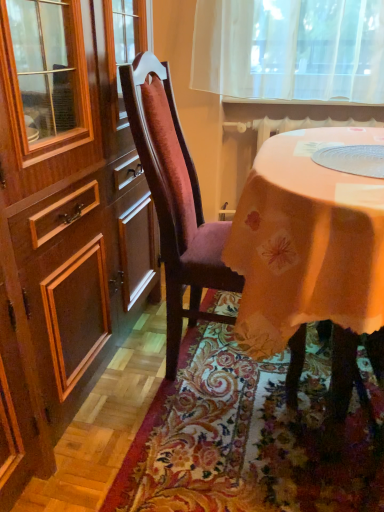
Describe the element at coordinates (175, 200) in the screenshot. The width and height of the screenshot is (384, 512). I see `velvet burgundy chair at center` at that location.

Image resolution: width=384 pixels, height=512 pixels. I want to click on velvet burgundy chair at center, so click(175, 200).

The image size is (384, 512). What do you see at coordinates (244, 439) in the screenshot?
I see `floral carpet at lower center` at bounding box center [244, 439].

Find the location of a particular element. The height and width of the screenshot is (512, 384). floral carpet at lower center is located at coordinates (244, 439).

Find the location of a particular element. The image size is (384, 512). velvet burgundy chair at center is located at coordinates (175, 200).

Can you confirm if floral carpet at lower center is positioned to the right of velvet burgundy chair at center?

Correct, you'll find floral carpet at lower center to the right of velvet burgundy chair at center.

Does floral carpet at lower center lie behind velvet burgundy chair at center?

No, floral carpet at lower center is closer to the viewer.

Is point (228, 420) closer to camera compared to point (179, 254)?

No, it is not.

From the image's perspective, between floral carpet at lower center and velvet burgundy chair at center, which one is located above?

velvet burgundy chair at center, from the image's perspective.

From a real-world perspective, is floral carpet at lower center physically below velvet burgundy chair at center?

Correct, in the physical world, floral carpet at lower center is lower than velvet burgundy chair at center.

Considering the sizes of objects floral carpet at lower center and velvet burgundy chair at center in the image provided, who is thinner, floral carpet at lower center or velvet burgundy chair at center?

Thinner between the two is velvet burgundy chair at center.

Does floral carpet at lower center have a lesser height compared to velvet burgundy chair at center?

Indeed, floral carpet at lower center has a lesser height compared to velvet burgundy chair at center.

Which of these two, floral carpet at lower center or velvet burgundy chair at center, is bigger?

Bigger between the two is velvet burgundy chair at center.

Is floral carpet at lower center outside of velvet burgundy chair at center?

Yes.

Is floral carpet at lower center far from velvet burgundy chair at center?

They are positioned close to each other.

Is floral carpet at lower center oriented towards velvet burgundy chair at center?

Yes, floral carpet at lower center is oriented towards velvet burgundy chair at center.

What's the angular difference between floral carpet at lower center and velvet burgundy chair at center's facing directions?

They differ by 91.2 degrees in their facing directions.

This screenshot has height=512, width=384. I want to click on mat located below the velvet burgundy chair at center (from the image's perspective), so [244, 439].

Does velvet burgundy chair at center appear on the right side of floral carpet at lower center?

In fact, velvet burgundy chair at center is to the left of floral carpet at lower center.

Which object is further away from the camera taking this photo, velvet burgundy chair at center or floral carpet at lower center?

Positioned behind is velvet burgundy chair at center.

Which is closer, (152, 90) or (227, 338)?

Point (152, 90) is positioned closer to the camera compared to point (227, 338).

From the image's perspective, which is below, velvet burgundy chair at center or floral carpet at lower center?

From the image's view, floral carpet at lower center is below.

From a real-world perspective, which object rests below the other?

In real-world perspective, floral carpet at lower center is lower.

Considering the sizes of velvet burgundy chair at center and floral carpet at lower center in the image, is velvet burgundy chair at center wider or thinner than floral carpet at lower center?

In the image, velvet burgundy chair at center appears to be more narrow than floral carpet at lower center.

In the scene shown: Who is taller, velvet burgundy chair at center or floral carpet at lower center?

velvet burgundy chair at center.

Considering the relative sizes of velvet burgundy chair at center and floral carpet at lower center in the image provided, is velvet burgundy chair at center bigger than floral carpet at lower center?

Correct, velvet burgundy chair at center is larger in size than floral carpet at lower center.

Is velvet burgundy chair at center not within floral carpet at lower center?

Absolutely, velvet burgundy chair at center is external to floral carpet at lower center.

Is velvet burgundy chair at center next to floral carpet at lower center?

No, velvet burgundy chair at center is not touching floral carpet at lower center.

Could you tell me if velvet burgundy chair at center is facing floral carpet at lower center?

No.

Can you tell me how much velvet burgundy chair at center and floral carpet at lower center differ in facing direction?

The angle between the facing direction of velvet burgundy chair at center and the facing direction of floral carpet at lower center is 91.2 degrees.

Where is `chair behind the floral carpet at lower center`? chair behind the floral carpet at lower center is located at coordinates (175, 200).

You are a GUI agent. You are given a task and a screenshot of the screen. Output one action in this format:
    pyautogui.click(x=<x>, y=<y>)
    Task: Click on the mat below the velvet burgundy chair at center (from the image's perspective)
    The image size is (384, 512).
    Given the screenshot: What is the action you would take?
    click(x=244, y=439)

At what (x,y) coordinates should I click in order to perform the action: click on chair lying on the left of floral carpet at lower center. Please return your answer as a coordinate pair (x, y). Looking at the image, I should click on (175, 200).